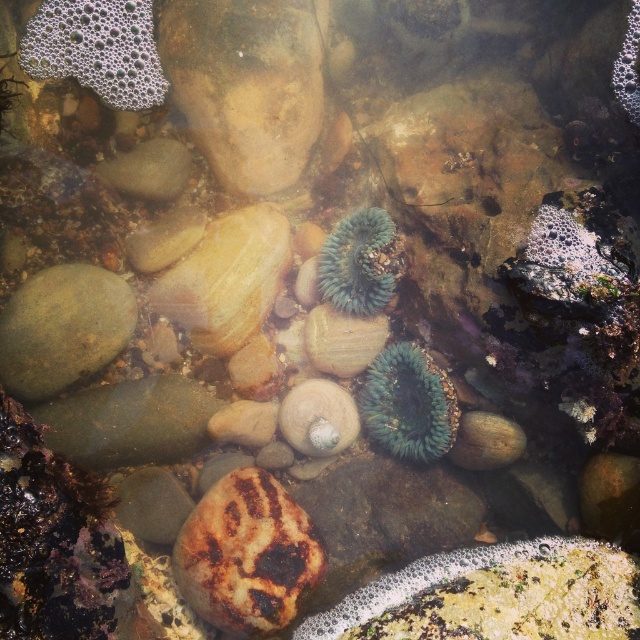
Is green smooth rock at left below teal fuzzy anemone at center?

Yes, green smooth rock at left is below teal fuzzy anemone at center.

Between green smooth rock at left and teal fuzzy anemone at center, which one appears on the right side from the viewer's perspective?

From the viewer's perspective, teal fuzzy anemone at center appears more on the right side.

Where is `green smooth rock at left`? green smooth rock at left is located at coordinates (61, 328).

Which is more to the left, green fuzzy anemone at center or teal fuzzy anemone at center?

From the viewer's perspective, teal fuzzy anemone at center appears more on the left side.

Is green fuzzy anemone at center closer to the viewer compared to teal fuzzy anemone at center?

Yes, green fuzzy anemone at center is in front of teal fuzzy anemone at center.

Does point (400, 406) lie behind point (353, 256)?

Yes, point (400, 406) is farther from viewer.

The height and width of the screenshot is (640, 640). In order to click on green fuzzy anemone at center in this screenshot , I will do `click(408, 403)`.

Is green smooth rock at left shorter than green fuzzy anemone at center?

No, green smooth rock at left is not shorter than green fuzzy anemone at center.

Can you confirm if green smooth rock at left is positioned to the right of green fuzzy anemone at center?

In fact, green smooth rock at left is to the left of green fuzzy anemone at center.

Where is `green smooth rock at left`? The height and width of the screenshot is (640, 640). green smooth rock at left is located at coordinates (61, 328).

Locate an element on the screen. green smooth rock at left is located at coordinates (61, 328).